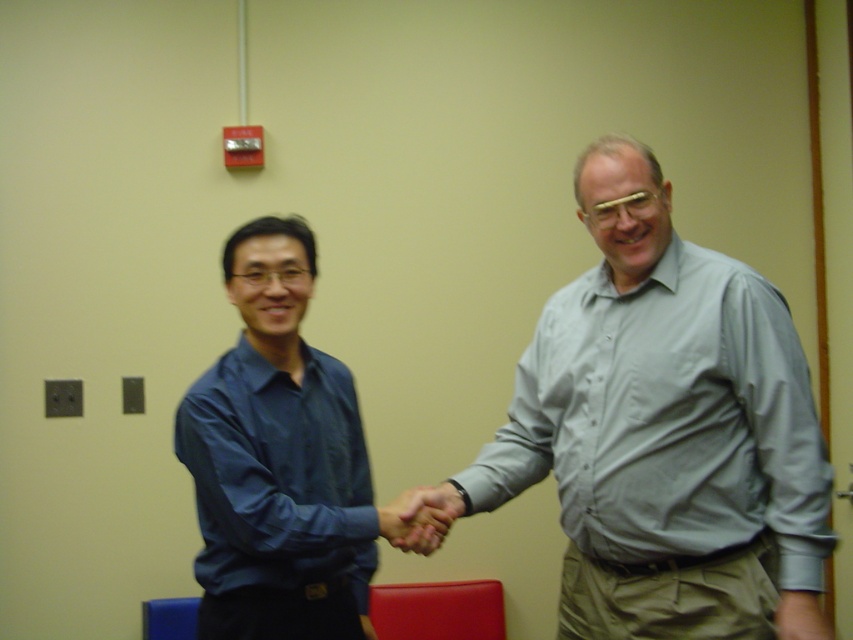
From the picture: Is light gray shirt at center below smooth skin handshake at center?

No, light gray shirt at center is not below smooth skin handshake at center.

At what (x,y) coordinates should I click in order to perform the action: click on light gray shirt at center. Please return your answer as a coordinate pair (x, y). This screenshot has height=640, width=853. Looking at the image, I should click on (666, 432).

Based on the photo, who is taller, matte blue shirt at center or smooth skin handshake at center?

matte blue shirt at center is taller.

Does matte blue shirt at center have a greater width compared to smooth skin handshake at center?

Correct, the width of matte blue shirt at center exceeds that of smooth skin handshake at center.

At what (x,y) coordinates should I click in order to perform the action: click on matte blue shirt at center. Please return your answer as a coordinate pair (x, y). This screenshot has height=640, width=853. Looking at the image, I should click on [x=277, y=460].

How distant is light gray shirt at center from matte blue shirt at center?

light gray shirt at center is 48.96 centimeters away from matte blue shirt at center.

Where is `light gray shirt at center`? The height and width of the screenshot is (640, 853). light gray shirt at center is located at coordinates (666, 432).

You are a GUI agent. You are given a task and a screenshot of the screen. Output one action in this format:
    pyautogui.click(x=<x>, y=<y>)
    Task: Click on the light gray shirt at center
    The height and width of the screenshot is (640, 853).
    Given the screenshot: What is the action you would take?
    pyautogui.click(x=666, y=432)

Find the location of `light gray shirt at center`. light gray shirt at center is located at coordinates (666, 432).